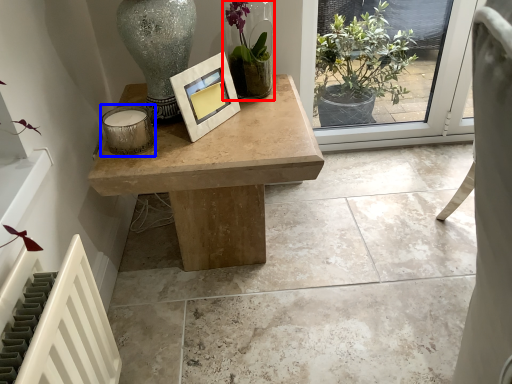
Question: Which of the following is the closest to the observer, houseplant (highlighted by a red box) or candle holder (highlighted by a blue box)?

Choices:
 (A) houseplant
 (B) candle holder

Answer: (B)